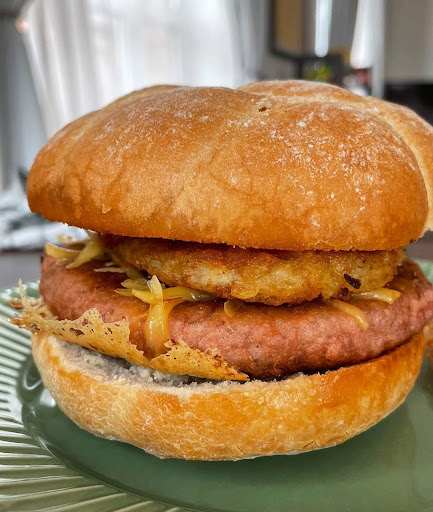
I want to click on outer rim of plate, so click(x=9, y=454).